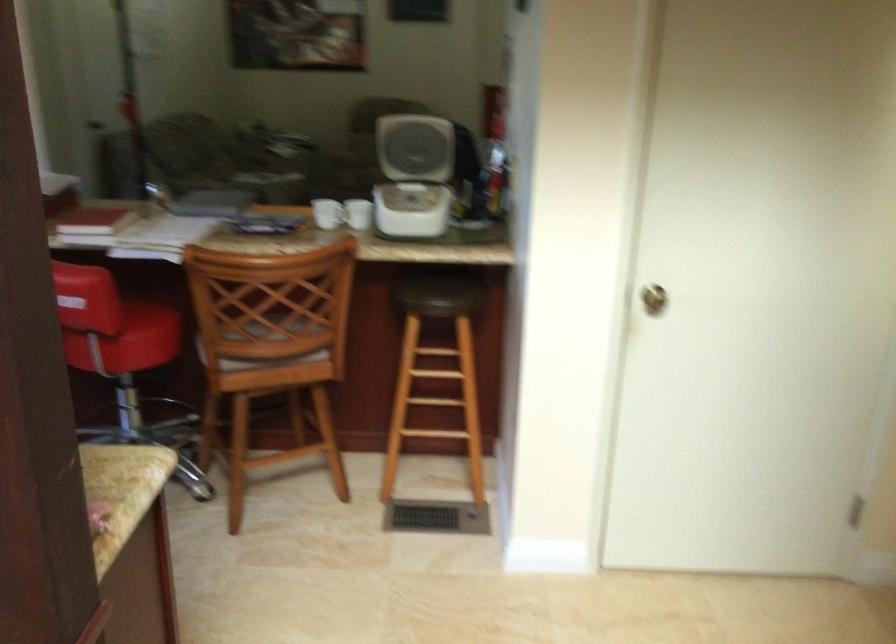
Where is `white appliance lid`? white appliance lid is located at coordinates (416, 137).